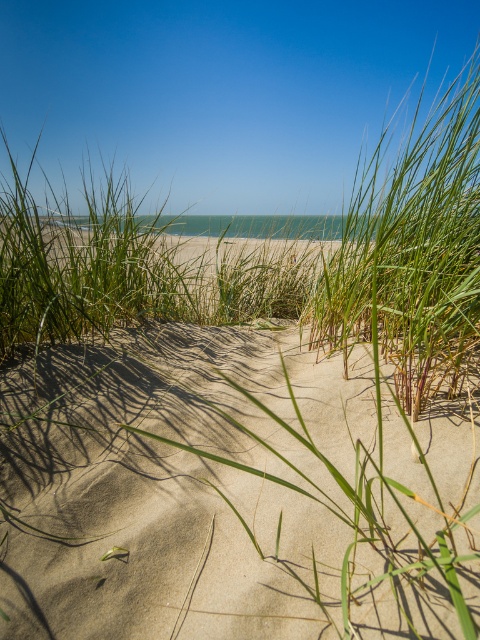
You are standing at the edge of the beach and want to walk towards the turquoise sea. You see the sandy beige sand at center and the green grass at center. Which path should you choose to reach the sea first?

The sandy beige sand at center is positioned on the left side of green grass at center, so choosing the sandy beige sand at center path will lead you closer to the sea first.

You are standing on the sandy beige sand at center and want to reach the calm turquoise waters of the sea. Which direction should you move relative to the green grass at center to get to the water?

The sandy beige sand at center is in front of the green grass at center, so you should move forward away from the green grass at center to reach the calm turquoise waters of the sea.

You are standing at the center of the image and want to walk towards the sandy beige sand at center. In which direction should you move?

The sandy beige sand at center is already at the center of the image, so you don not need to move in any direction to reach it.